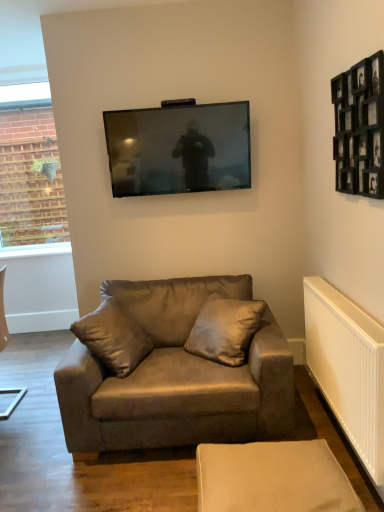
Question: From the image's perspective, is suede brown couch at center located above black wooden picture frame at upper right?

Choices:
 (A) yes
 (B) no

Answer: (B)

Question: Is suede brown couch at center thinner than black wooden picture frame at upper right?

Choices:
 (A) no
 (B) yes

Answer: (A)

Question: Can you confirm if suede brown couch at center is bigger than black wooden picture frame at upper right?

Choices:
 (A) no
 (B) yes

Answer: (B)

Question: Does suede brown couch at center have a lesser height compared to black wooden picture frame at upper right?

Choices:
 (A) yes
 (B) no

Answer: (B)

Question: Is suede brown couch at center with black wooden picture frame at upper right?

Choices:
 (A) no
 (B) yes

Answer: (A)

Question: Can you confirm if suede brown couch at center is positioned to the left of black wooden picture frame at upper right?

Choices:
 (A) yes
 (B) no

Answer: (A)

Question: Is suede brown couch at center not within suede-like beige pillow at center?

Choices:
 (A) yes
 (B) no

Answer: (A)

Question: Is suede brown couch at center smaller than suede-like beige pillow at center?

Choices:
 (A) no
 (B) yes

Answer: (A)

Question: Considering the relative sizes of suede brown couch at center and suede-like beige pillow at center in the image provided, is suede brown couch at center shorter than suede-like beige pillow at center?

Choices:
 (A) yes
 (B) no

Answer: (B)

Question: Can you confirm if suede brown couch at center is wider than suede-like beige pillow at center?

Choices:
 (A) yes
 (B) no

Answer: (A)

Question: Is suede brown couch at center thinner than suede-like beige pillow at center?

Choices:
 (A) yes
 (B) no

Answer: (B)

Question: Considering the relative sizes of suede brown couch at center and suede-like beige pillow at center in the image provided, is suede brown couch at center bigger than suede-like beige pillow at center?

Choices:
 (A) yes
 (B) no

Answer: (A)

Question: From the image's perspective, is matte black tv at upper center on top of white plastic radiator at lower right?

Choices:
 (A) yes
 (B) no

Answer: (A)